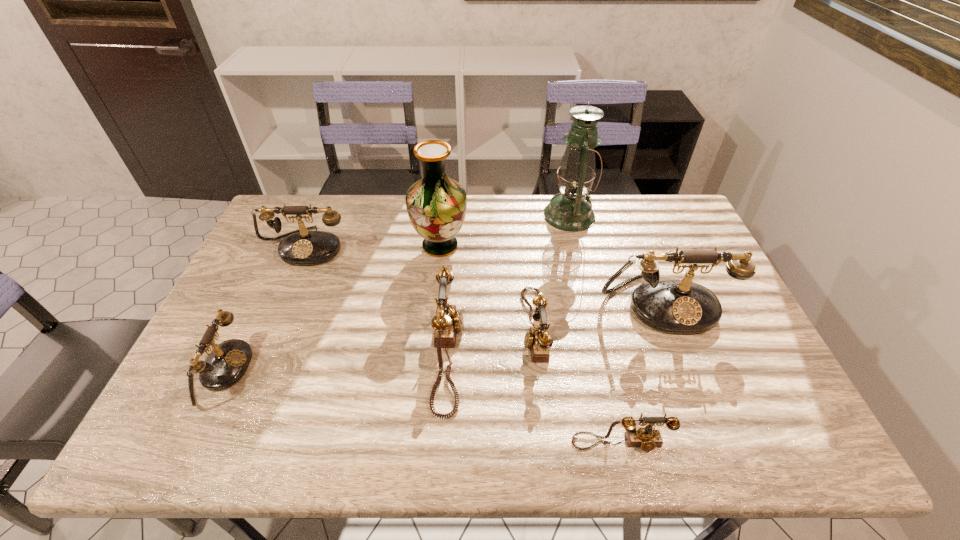
The image size is (960, 540). I want to click on free space at the far left corner of the desktop, so (287, 205).

This screenshot has width=960, height=540. In the image, there is a desktop. What are the coordinates of `free space at the near left corner` in the screenshot? It's located at (181, 436).

Identify the location of vacant region at the far right corner. (675, 206).

Where is `vacant region between the vase and the second biggest brown telephone`? The height and width of the screenshot is (540, 960). vacant region between the vase and the second biggest brown telephone is located at coordinates (487, 286).

Locate an element on the screen. vacant space that's between the biggest brown telephone and the second farthest black telephone is located at coordinates (555, 328).

Where is `blank region between the biggest black telephone and the second biggest brown telephone`? blank region between the biggest black telephone and the second biggest brown telephone is located at coordinates (597, 314).

The width and height of the screenshot is (960, 540). Find the location of `vacant space that is in between the second smallest black telephone and the fourth telephone from right to left`. vacant space that is in between the second smallest black telephone and the fourth telephone from right to left is located at coordinates (377, 300).

This screenshot has width=960, height=540. Identify the location of free space between the nearest black telephone and the farthest black telephone. (263, 309).

Locate an element on the screen. Image resolution: width=960 pixels, height=540 pixels. free spot between the nearest black telephone and the oil lamp is located at coordinates (394, 293).

Identify the location of vacant space that is in between the fourth telephone from right to left and the farthest telephone. This screenshot has width=960, height=540. (377, 300).